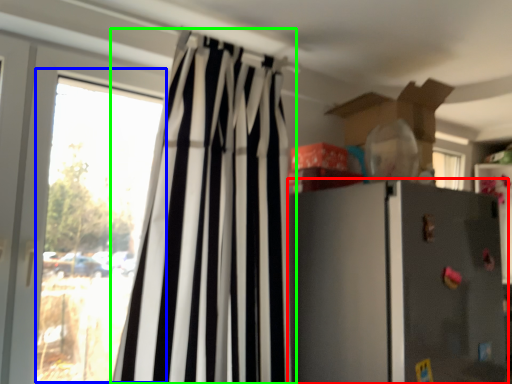
Question: Which is nearer to the refrigerator (highlighted by a red box)? window (highlighted by a blue box) or curtain (highlighted by a green box).

Choices:
 (A) window
 (B) curtain

Answer: (B)